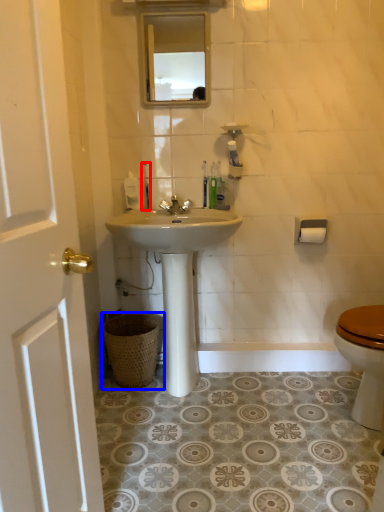
Question: Which of the following is the closest to the observer, toothbrush (highlighted by a red box) or trash bin/can (highlighted by a blue box)?

Choices:
 (A) toothbrush
 (B) trash bin/can

Answer: (B)